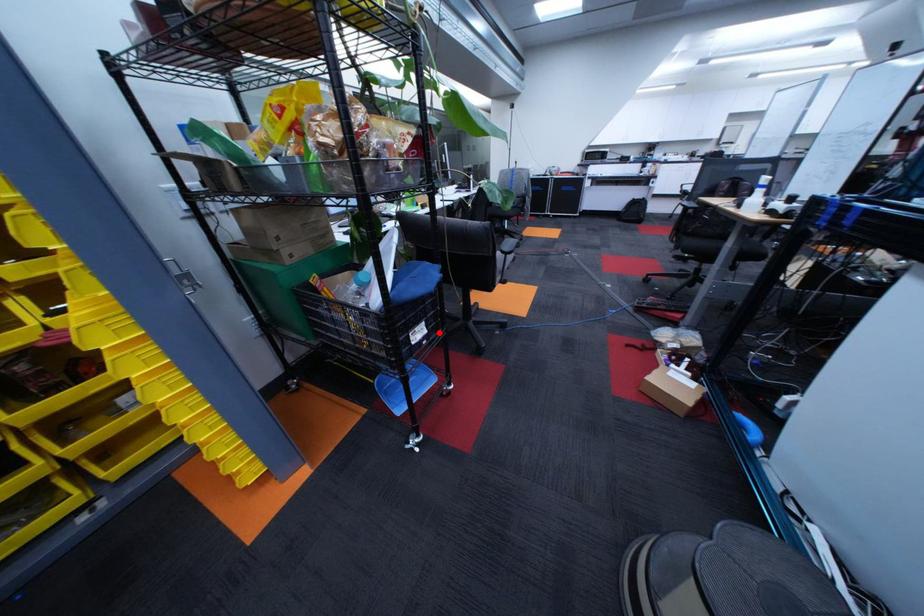
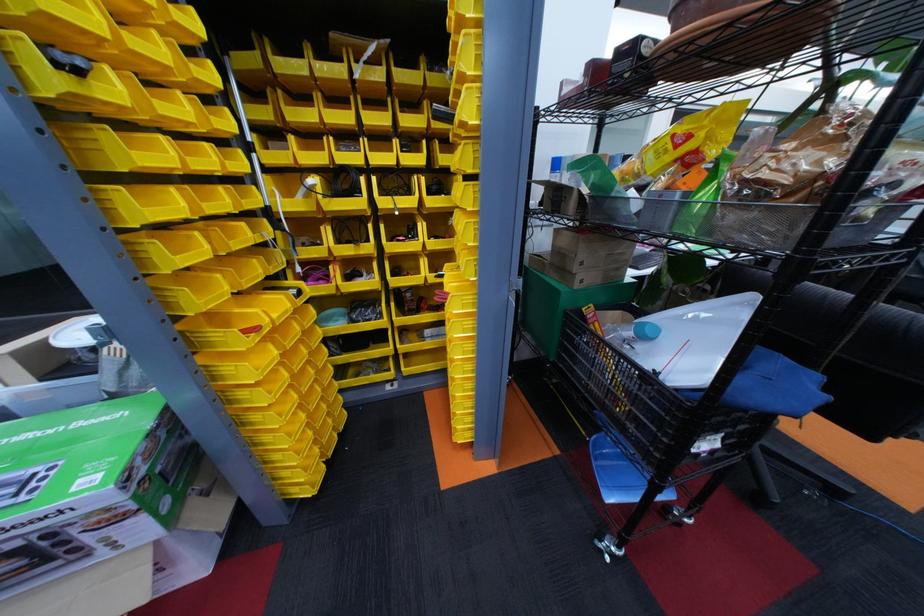
Locate, in the second image, the point that corresponds to the highlighted location in the first image.

(732, 446)